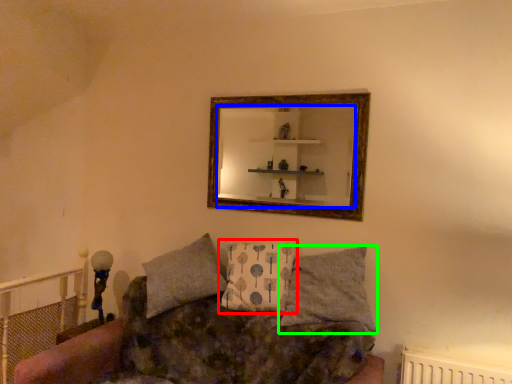
Question: Estimate the real-world distances between objects in this image. Which object is farther from pillow (highlighted by a red box), mirror (highlighted by a blue box) or pillow (highlighted by a green box)?

Choices:
 (A) mirror
 (B) pillow

Answer: (A)